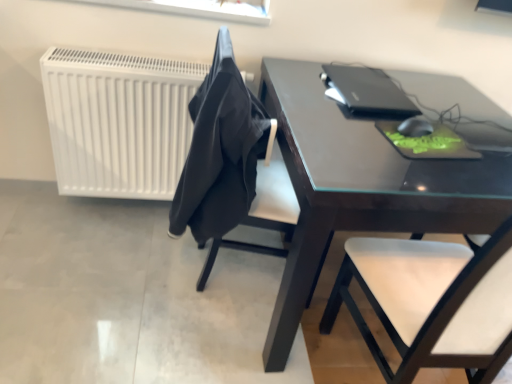
The height and width of the screenshot is (384, 512). I want to click on vacant space positioned to the left of dark brown glossy table at center, so (131, 291).